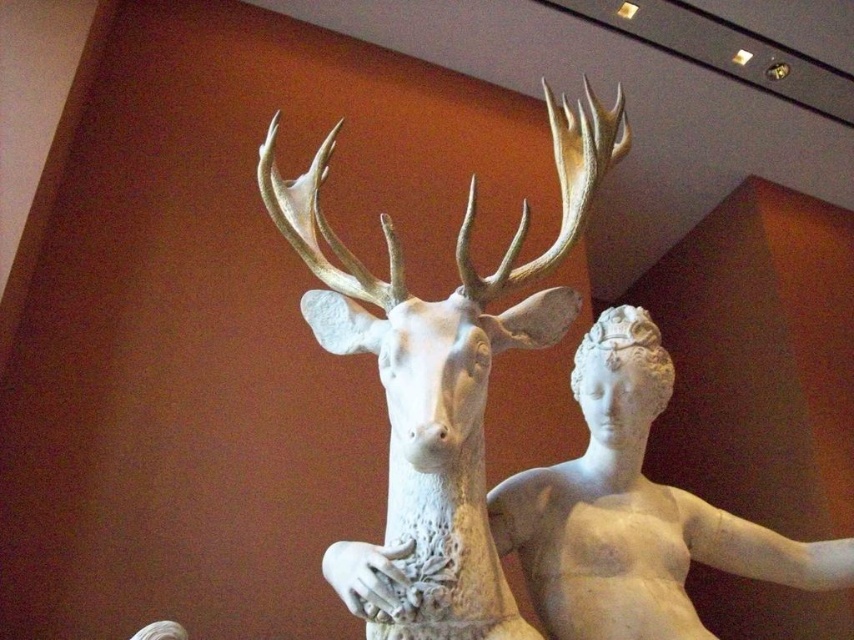
Question: From the image, what is the correct spatial relationship of white marble deer at center in relation to white marble statue at center?

Choices:
 (A) below
 (B) above

Answer: (B)

Question: Which object is farther from the camera taking this photo?

Choices:
 (A) white marble deer at center
 (B) white marble statue at center

Answer: (B)

Question: Is white marble deer at center closer to camera compared to white marble statue at center?

Choices:
 (A) no
 (B) yes

Answer: (B)

Question: Which object is farther from the camera taking this photo?

Choices:
 (A) white marble statue at center
 (B) white marble deer at center

Answer: (A)

Question: Where is white marble deer at center located in relation to white marble statue at center in the image?

Choices:
 (A) right
 (B) left

Answer: (B)

Question: Which point is farther to the camera?

Choices:
 (A) (436, 634)
 (B) (556, 561)

Answer: (B)